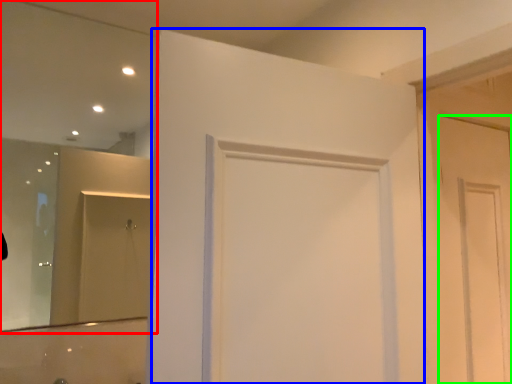
Question: Estimate the real-world distances between objects in this image. Which object is farther from mirror (highlighted by a red box), door (highlighted by a blue box) or door (highlighted by a green box)?

Choices:
 (A) door
 (B) door

Answer: (B)